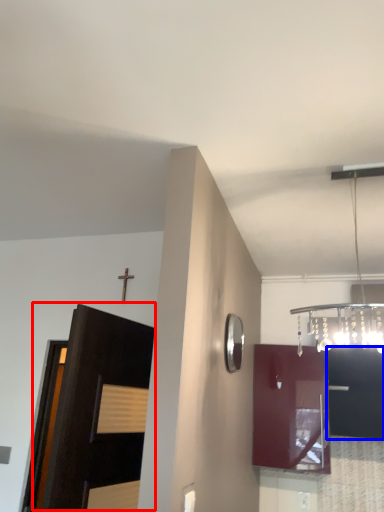
Question: Which of the following is the farthest to the observer, door (highlighted by a red box) or cabinetry (highlighted by a blue box)?

Choices:
 (A) door
 (B) cabinetry

Answer: (B)